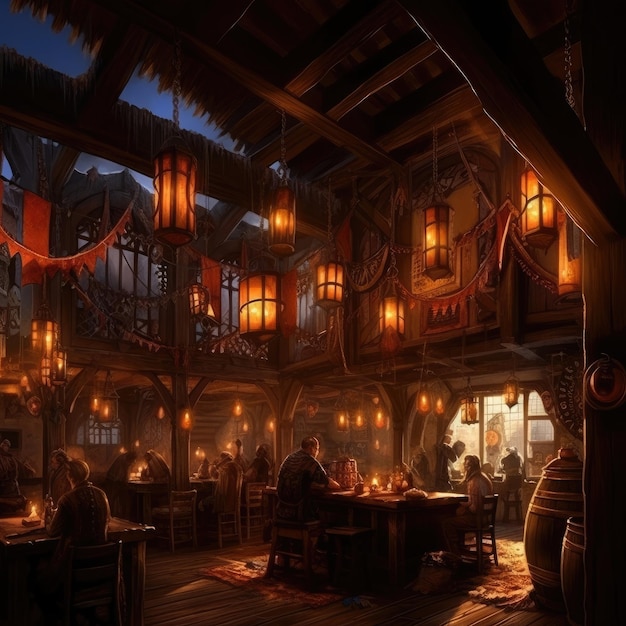
The width and height of the screenshot is (626, 626). In order to click on lights in this screenshot , I will do `click(249, 310)`.